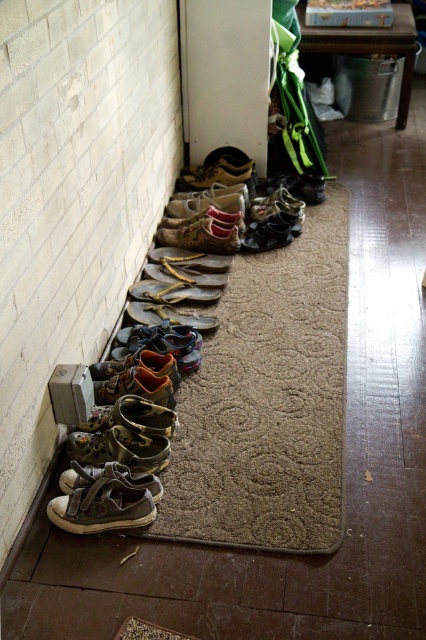
You are standing at the entrance of the hallway and want to pick up the leather sandal at lower left and the matte black shoe at center. If your reach is 1.5 meters, can you grab both without moving your feet?

The leather sandal at lower left is 1.51 meters from the matte black shoe at center. Since your reach is only 1.5 meters, you cannot grab both without moving your feet.

You are standing in the hallway and want to pick up an object located at point (x=66, y=477). Considering your height is 5 feet 6 inches, can you comfortably reach this point without needing to bend down or stretch excessively?

The point (x=66, y=477) is 5.84 feet away from the viewer. Since the distance is greater than your height of 5 feet 6 inches, you would need to take a step forward or move closer to comfortably reach it without excessive bending or stretching.